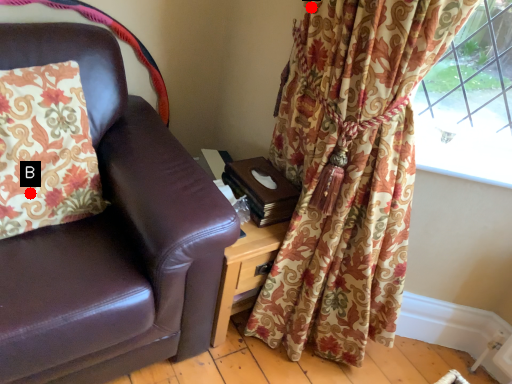
Question: Two points are circled on the image, labeled by A and B beside each circle. Which of the following is the farthest from the observer?

Choices:
 (A) A is further
 (B) B is further

Answer: (A)